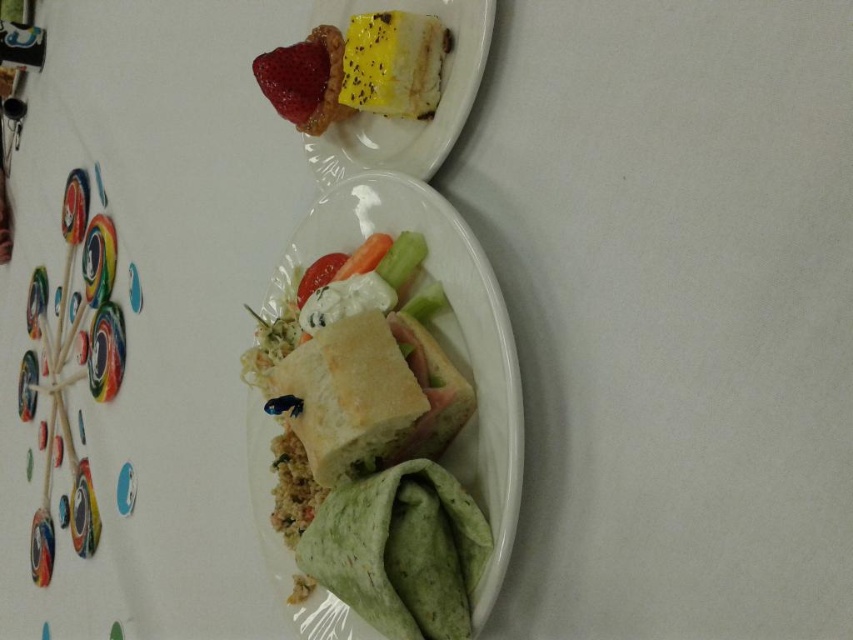
Question: Which point is farther to the camera?

Choices:
 (A) (300, 77)
 (B) (389, 365)
 (C) (364, 262)
 (D) (300, 301)

Answer: (D)

Question: Can you confirm if green tortilla at lower left is smaller than red matte strawberry at upper left?

Choices:
 (A) no
 (B) yes

Answer: (A)

Question: In this image, where is white bread at center located relative to smooth white strawberry at center?

Choices:
 (A) right
 (B) left

Answer: (A)

Question: Is sliced carrot at center below smooth white strawberry at center?

Choices:
 (A) no
 (B) yes

Answer: (A)

Question: Which of the following is the closest to the observer?

Choices:
 (A) red matte strawberry at upper left
 (B) white bread at center

Answer: (B)

Question: Which of the following is the farthest from the observer?

Choices:
 (A) green tortilla at lower left
 (B) white bread at center

Answer: (B)